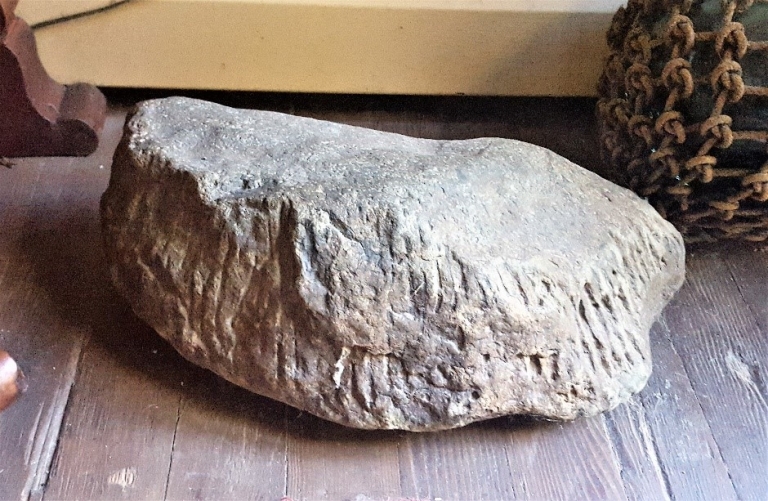
The image size is (768, 501). In order to click on wall in this screenshot , I will do `click(563, 41)`.